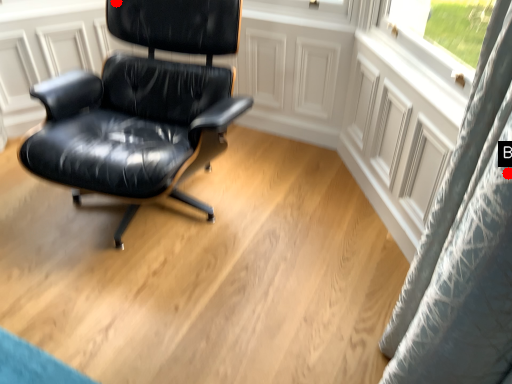
Question: Two points are circled on the image, labeled by A and B beside each circle. Which point is further to the camera?

Choices:
 (A) A is further
 (B) B is further

Answer: (A)